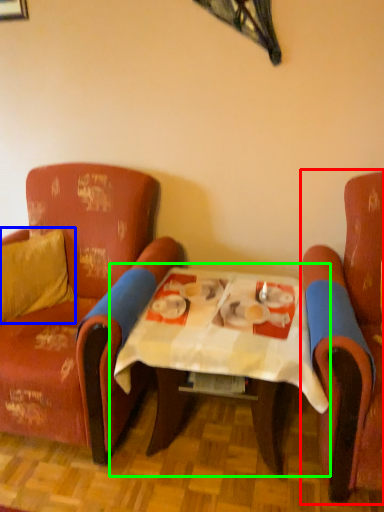
Question: Considering the real-world distances, which object is farthest from chair (highlighted by a red box)? pillow (highlighted by a blue box) or table (highlighted by a green box)?

Choices:
 (A) pillow
 (B) table

Answer: (A)